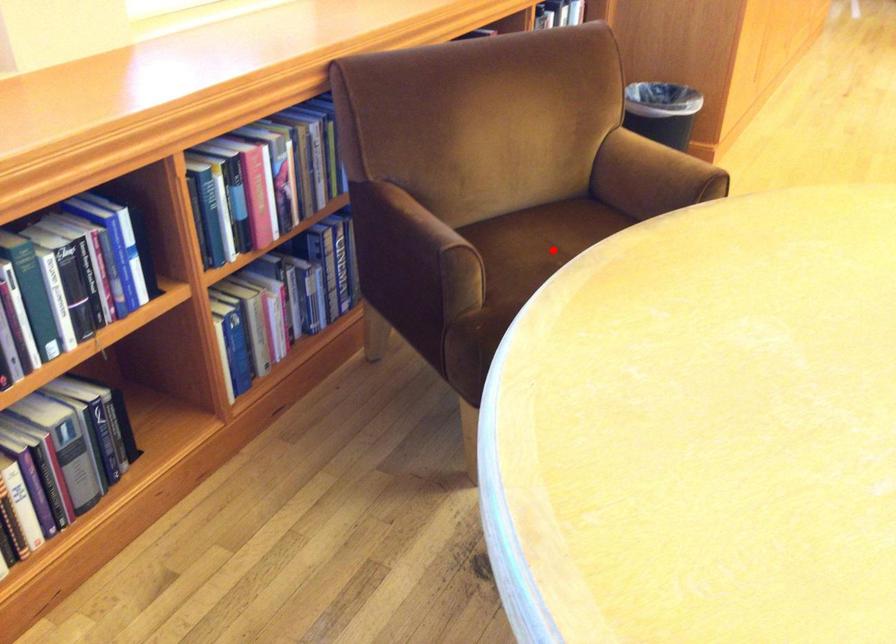
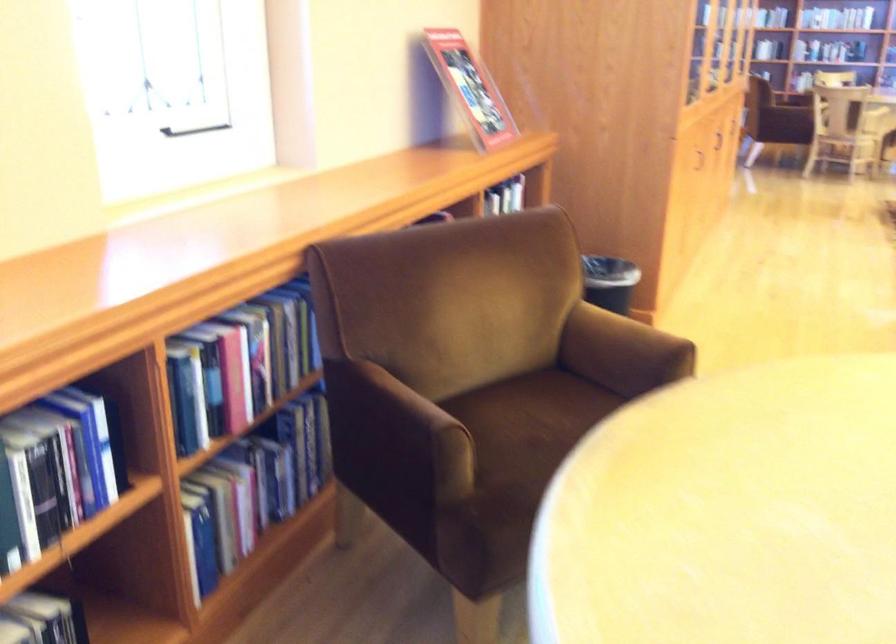
Locate, in the second image, the point that corresponds to the highlighted location in the first image.

(535, 426)